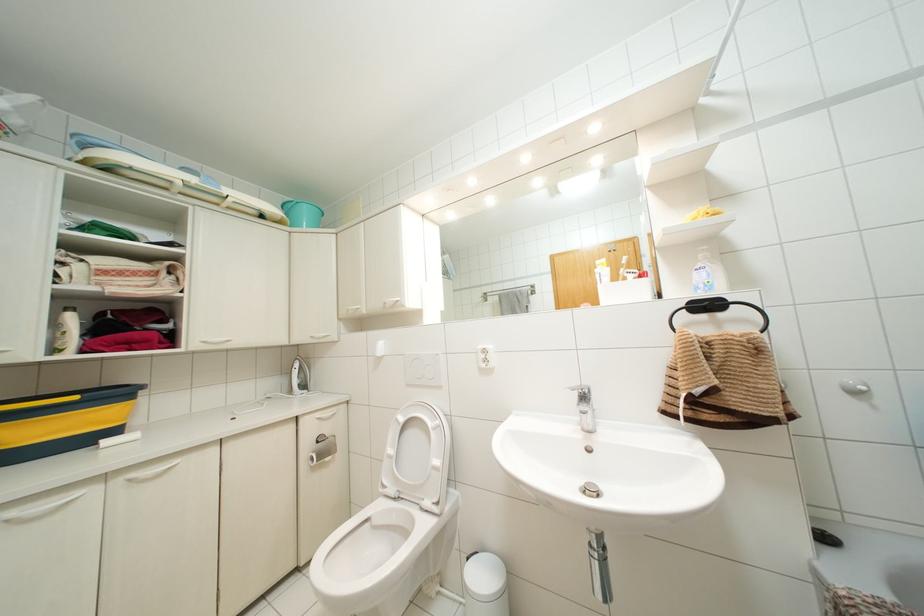
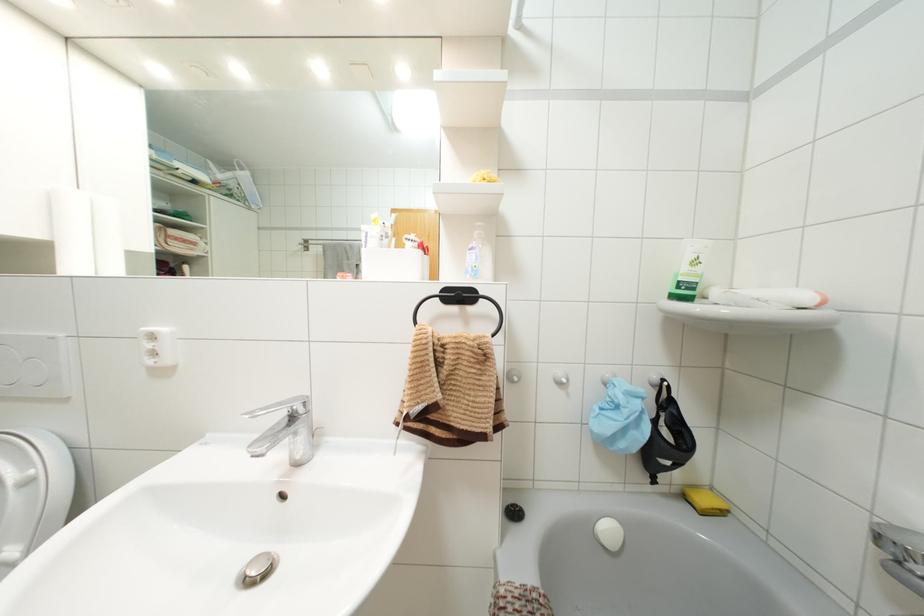
Find the pixel in the second image that matches (x=854, y=392) in the first image.

(558, 383)